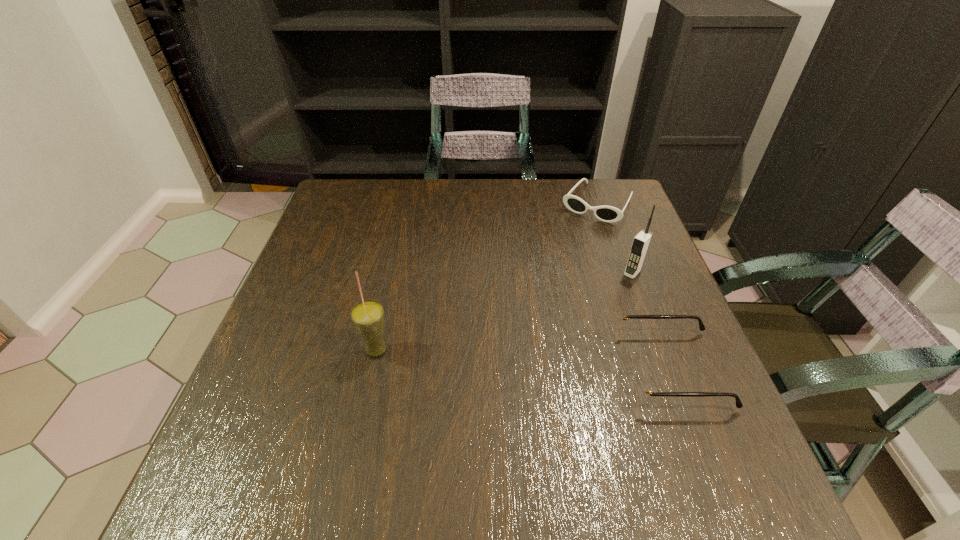
Where is `vacant space in between the third nearest object and the spectacles`? vacant space in between the third nearest object and the spectacles is located at coordinates (652, 321).

The height and width of the screenshot is (540, 960). Find the location of `free spot between the sunglasses and the second farthest object`. free spot between the sunglasses and the second farthest object is located at coordinates (615, 238).

Locate an element on the screen. The image size is (960, 540). vacant region between the leftmost object and the spectacles is located at coordinates (524, 360).

The image size is (960, 540). Identify the location of free point between the leftmost object and the farthest object. (487, 277).

Image resolution: width=960 pixels, height=540 pixels. Find the location of `free space between the third nearest object and the spectacles`. free space between the third nearest object and the spectacles is located at coordinates (652, 321).

In order to click on vacant space that's between the third nearest object and the straw for drinking in this screenshot , I will do `click(504, 311)`.

What are the coordinates of `free space between the sunglasses and the cellular telephone` in the screenshot? It's located at (615, 238).

I want to click on unoccupied area between the third nearest object and the spectacles, so click(652, 321).

Identify the location of vacant region between the cellular telephone and the farthest object. This screenshot has height=540, width=960. (615, 238).

Identify the location of object that is the third closest to the third nearest object. The image size is (960, 540). (367, 316).